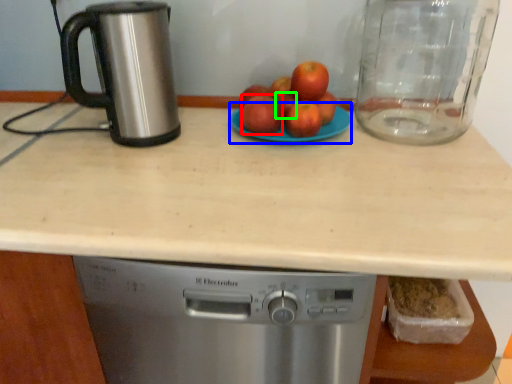
Question: Which object is positioned farthest from apple (highlighted by a red box)? Select from glass plate (highlighted by a blue box) and apple (highlighted by a green box).

Choices:
 (A) glass plate
 (B) apple

Answer: (A)